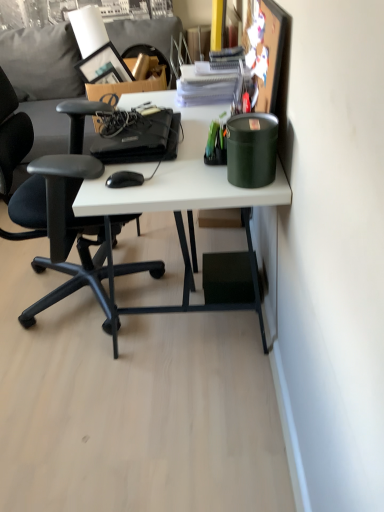
Where is `free spot in front of black plastic mouse at center`? The height and width of the screenshot is (512, 384). free spot in front of black plastic mouse at center is located at coordinates (130, 194).